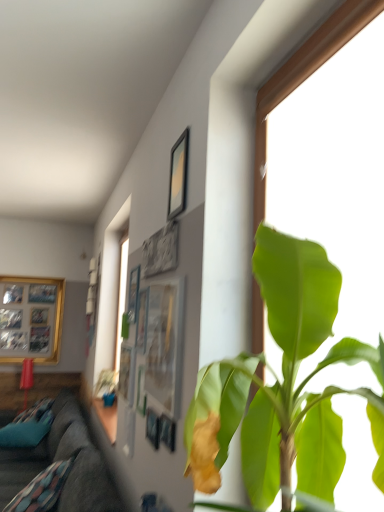
Question: Is dark gray fabric couch at lower left at the right side of matte black picture frame at upper center, the first picture frame when ordered from right to left?

Choices:
 (A) yes
 (B) no

Answer: (B)

Question: Is dark gray fabric couch at lower left further to the viewer compared to matte black picture frame at upper center, marked as the fourth picture frame in a back-to-front arrangement?

Choices:
 (A) no
 (B) yes

Answer: (B)

Question: Does dark gray fabric couch at lower left have a lesser height compared to matte black picture frame at upper center, which is counted as the second picture frame, starting from the front?

Choices:
 (A) yes
 (B) no

Answer: (B)

Question: From a real-world perspective, is dark gray fabric couch at lower left on matte black picture frame at upper center, marked as the fourth picture frame in a back-to-front arrangement?

Choices:
 (A) yes
 (B) no

Answer: (B)

Question: Can you see dark gray fabric couch at lower left touching matte black picture frame at upper center, the first picture frame when ordered from right to left?

Choices:
 (A) no
 (B) yes

Answer: (A)

Question: From a real-world perspective, is dark gray fabric couch at lower left below matte black picture frame at upper center, which is counted as the second picture frame, starting from the front?

Choices:
 (A) no
 (B) yes

Answer: (B)

Question: Is wooden photo frame at left, which is the 1th picture frame in back-to-front order, at the left side of matte glass picture frame at center, marked as the 5th picture frame in a back-to-front arrangement?

Choices:
 (A) yes
 (B) no

Answer: (A)

Question: Considering the relative positions of wooden photo frame at left, which ranks as the fifth picture frame in right-to-left order, and matte glass picture frame at center, the fourth picture frame when ordered from left to right, in the image provided, is wooden photo frame at left, which ranks as the fifth picture frame in right-to-left order, behind matte glass picture frame at center, the fourth picture frame when ordered from left to right,?

Choices:
 (A) yes
 (B) no

Answer: (A)

Question: From the image's perspective, would you say wooden photo frame at left, the 1th picture frame viewed from the left, is shown under matte glass picture frame at center, the fourth picture frame when ordered from left to right?

Choices:
 (A) no
 (B) yes

Answer: (B)

Question: From the image's perspective, is wooden photo frame at left, which ranks as the fifth picture frame in right-to-left order, over matte glass picture frame at center, the 2th picture frame from the right?

Choices:
 (A) yes
 (B) no

Answer: (B)

Question: Can you confirm if wooden photo frame at left, the 1th picture frame viewed from the left, is shorter than matte glass picture frame at center, positioned as the 1th picture frame in front-to-back order?

Choices:
 (A) no
 (B) yes

Answer: (A)

Question: Would you say wooden photo frame at left, which is the 1th picture frame in back-to-front order, contains matte glass picture frame at center, positioned as the 1th picture frame in front-to-back order?

Choices:
 (A) yes
 (B) no

Answer: (B)

Question: Considering the relative positions of matte black picture frame at upper center, the first picture frame when ordered from right to left, and wooden photo frame at left, which appears as the 5th picture frame when viewed from the front, in the image provided, is matte black picture frame at upper center, the first picture frame when ordered from right to left, to the right of wooden photo frame at left, which appears as the 5th picture frame when viewed from the front, from the viewer's perspective?

Choices:
 (A) yes
 (B) no

Answer: (A)